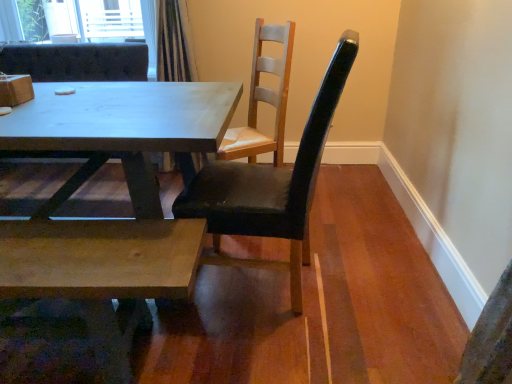
I want to click on empty space that is ontop of matte wood table at center (from a real-world perspective), so click(110, 108).